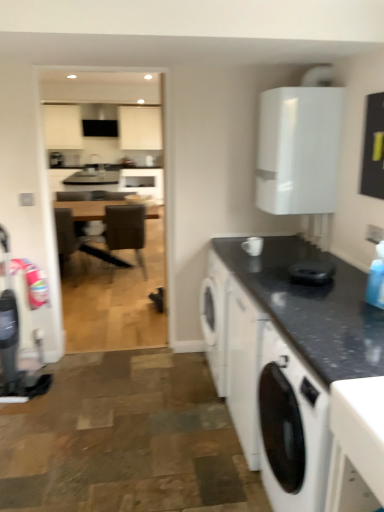
This screenshot has width=384, height=512. I want to click on free spot to the right of black glossy coffee cup at center, acting as the second appliance starting from the top, so click(x=344, y=283).